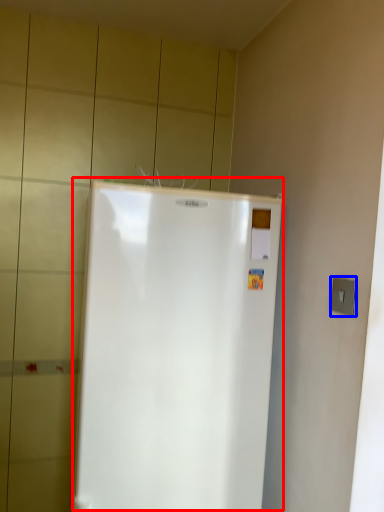
Question: Which object is closer to the camera taking this photo, refrigerator (highlighted by a red box) or electric outlet (highlighted by a blue box)?

Choices:
 (A) refrigerator
 (B) electric outlet

Answer: (B)